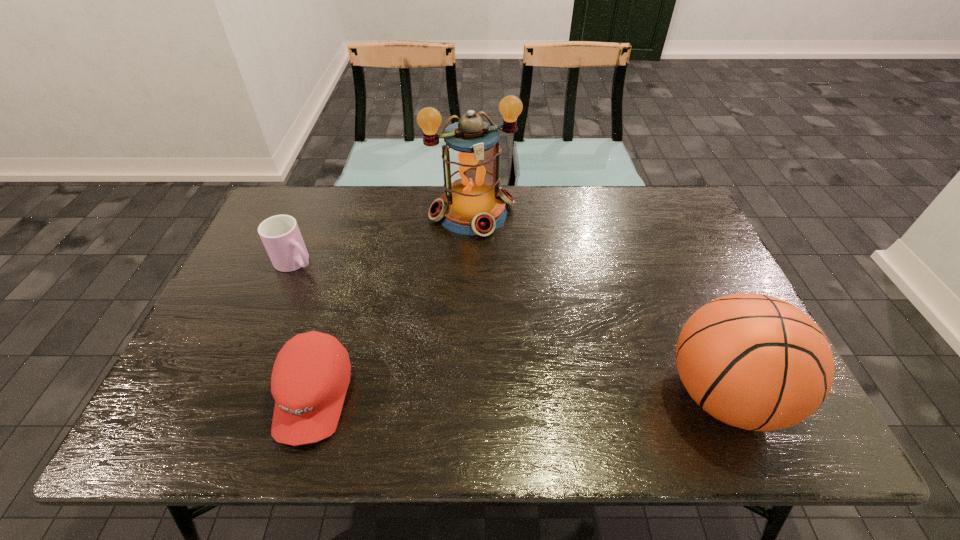
Identify the location of vacant region located on the front-facing side of the farthest object. (505, 278).

The height and width of the screenshot is (540, 960). In order to click on free space located 0.290m with the handle on the side of the leftmost object in this screenshot , I will do `click(380, 321)`.

The width and height of the screenshot is (960, 540). In order to click on vacant space positioned with the handle on the side of the leftmost object in this screenshot , I will do `click(321, 279)`.

Where is `free region located with the handle on the side of the leftmost object`? This screenshot has height=540, width=960. free region located with the handle on the side of the leftmost object is located at coordinates (409, 341).

You are a GUI agent. You are given a task and a screenshot of the screen. Output one action in this format:
    pyautogui.click(x=<x>, y=<y>)
    Task: Click on the object located at the far edge
    
    Given the screenshot: What is the action you would take?
    pyautogui.click(x=473, y=203)

This screenshot has height=540, width=960. What are the coordinates of `cap that is at the near edge` in the screenshot? It's located at (311, 374).

Locate an element on the screen. The width and height of the screenshot is (960, 540). basketball present at the near edge is located at coordinates (753, 361).

I want to click on object that is at the left edge, so 280,234.

The height and width of the screenshot is (540, 960). I want to click on object located in the right edge section of the desktop, so click(x=753, y=361).

I want to click on object positioned at the near right corner, so click(753, 361).